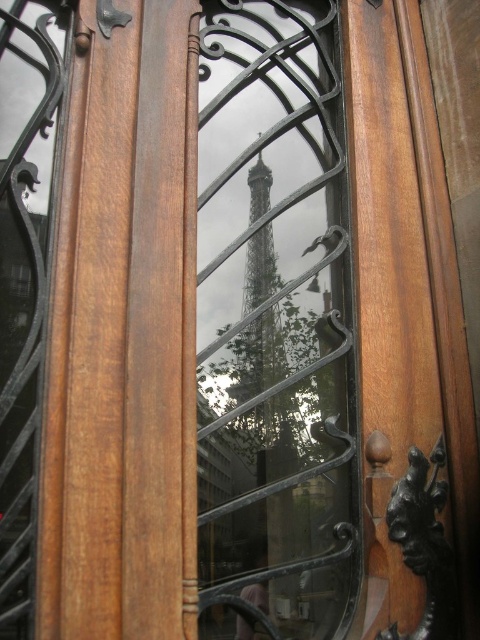
Question: Among these objects, which one is farthest from the camera?

Choices:
 (A) transparent glass window at center
 (B) metallic silver eiffel tower at center

Answer: (B)

Question: Which point appears farthest from the camera in this image?

Choices:
 (A) (296, 516)
 (B) (252, 365)

Answer: (B)

Question: Does transparent glass window at center come in front of metallic silver eiffel tower at center?

Choices:
 (A) no
 (B) yes

Answer: (B)

Question: Is transparent glass window at center to the right of metallic silver eiffel tower at center from the viewer's perspective?

Choices:
 (A) no
 (B) yes

Answer: (B)

Question: Does transparent glass window at center appear over metallic silver eiffel tower at center?

Choices:
 (A) no
 (B) yes

Answer: (B)

Question: Which point is farther to the camera?

Choices:
 (A) (228, 205)
 (B) (273, 333)

Answer: (A)